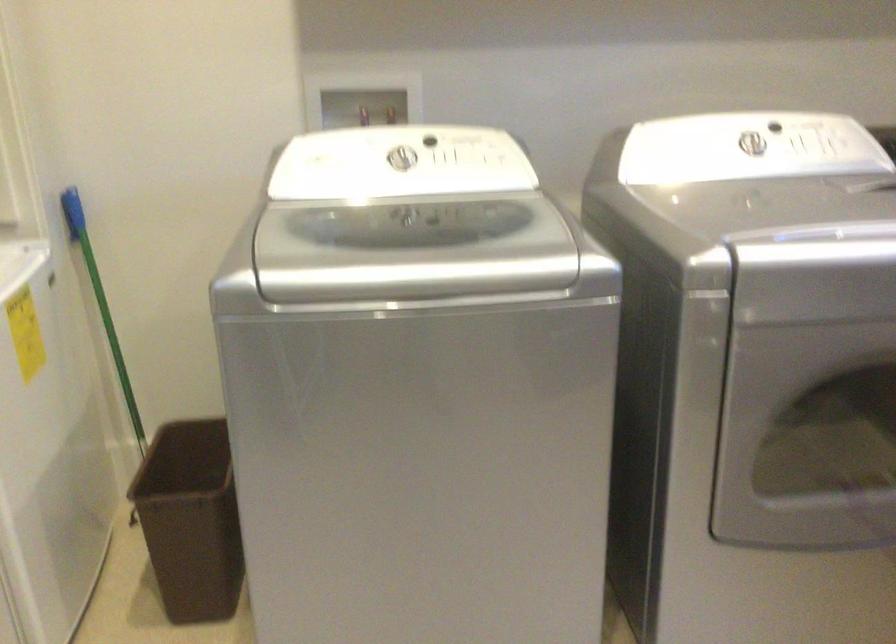
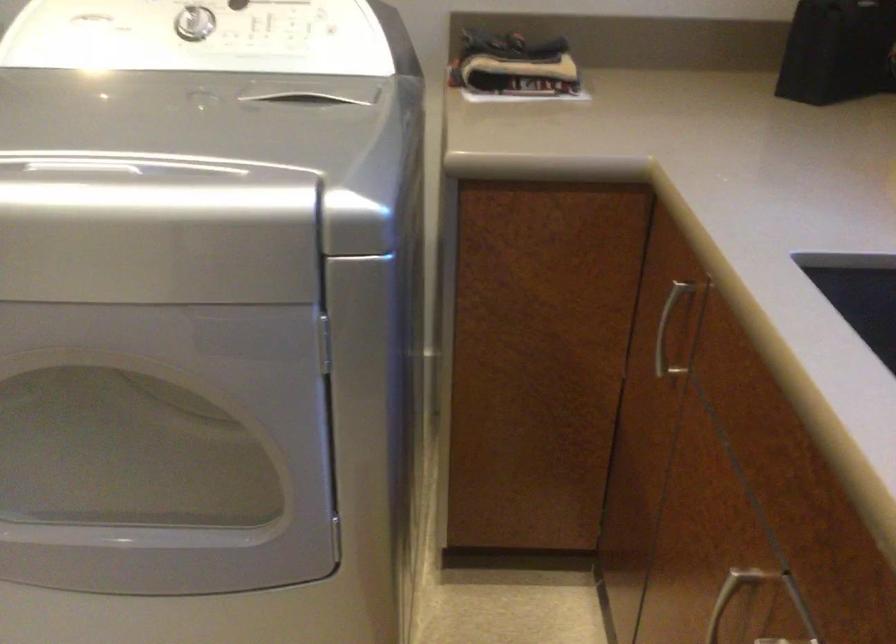
What movement of the cameraman would produce the second image?

The movement direction of the cameraman is right, forward.